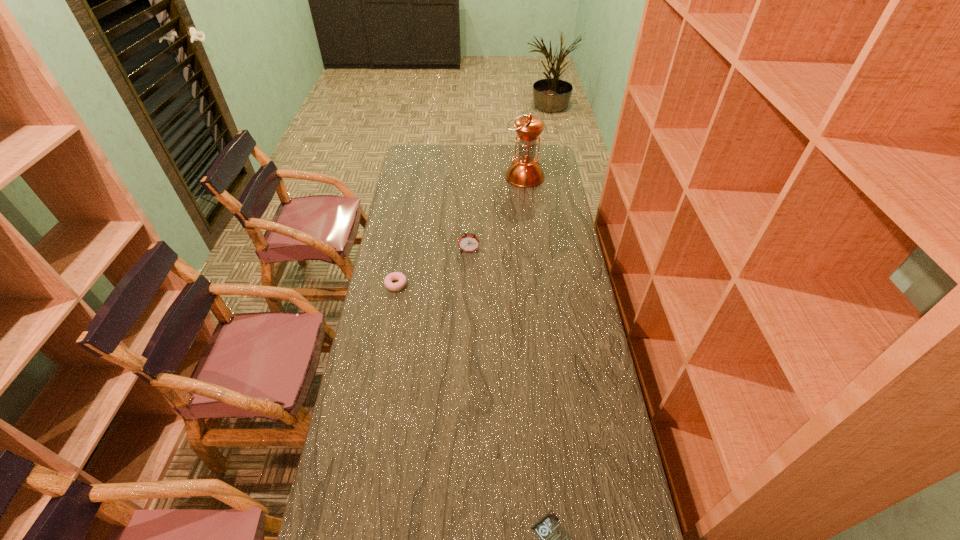
Locate an element on the screen. The image size is (960, 540). the tallest object is located at coordinates (525, 171).

This screenshot has height=540, width=960. I want to click on oil lamp, so click(x=525, y=171).

Image resolution: width=960 pixels, height=540 pixels. Find the location of `the third shortest object`. the third shortest object is located at coordinates (x=468, y=242).

You are a GUI agent. You are given a task and a screenshot of the screen. Output one action in this format:
    pyautogui.click(x=<x>, y=<y>)
    Task: Click on the third object from right to left
    Image resolution: width=960 pixels, height=540 pixels.
    Given the screenshot: What is the action you would take?
    pyautogui.click(x=468, y=242)

Identify the location of the leftmost object. This screenshot has height=540, width=960. (402, 281).

Locate an element on the screen. The image size is (960, 540). the second nearest object is located at coordinates (402, 281).

Identify the location of vacant space located 0.140m on the back of the farthest object. (521, 152).

Identify the location of vacant space positioned on the clock face of the third shortest object. (467, 326).

The image size is (960, 540). Find the location of `vacant space located 0.100m on the back of the leftmost object`. vacant space located 0.100m on the back of the leftmost object is located at coordinates (400, 259).

Where is `object located in the far edge section of the desktop`? object located in the far edge section of the desktop is located at coordinates (525, 171).